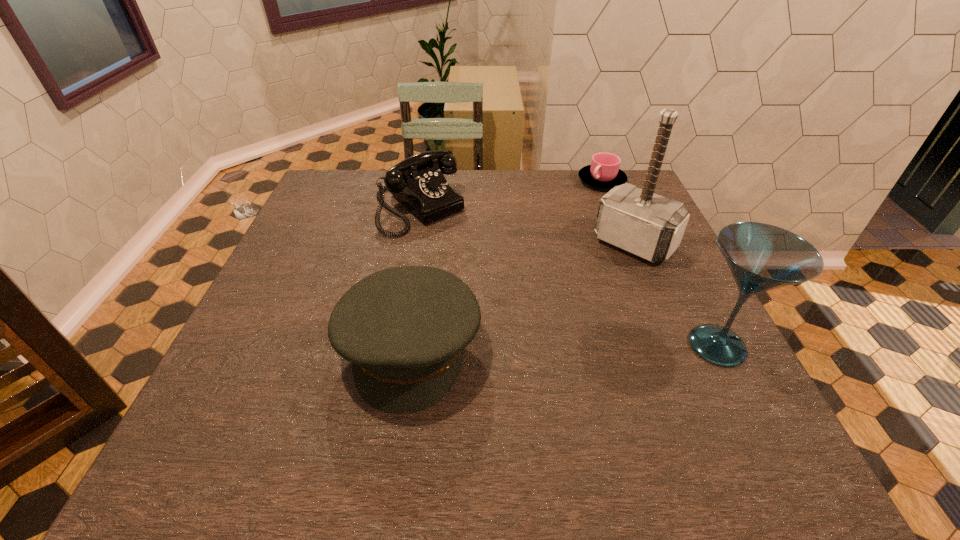
Identify the location of free space that satisfies the following two spatial constraints: 1. on the back side of the telephone; 2. on the right side of the cup. click(424, 181).

At what (x,y) coordinates should I click in order to perform the action: click on vacant space that satisfies the following two spatial constraints: 1. on the front side of the martini; 2. on the left side of the cup. Please return your answer as a coordinate pair (x, y). This screenshot has height=540, width=960. Looking at the image, I should click on (668, 346).

At what (x,y) coordinates should I click in order to perform the action: click on blank space that satisfies the following two spatial constraints: 1. on the front side of the hammer; 2. on the right side of the second tallest object. Please return your answer as a coordinate pair (x, y). The image size is (960, 540). Looking at the image, I should click on (678, 346).